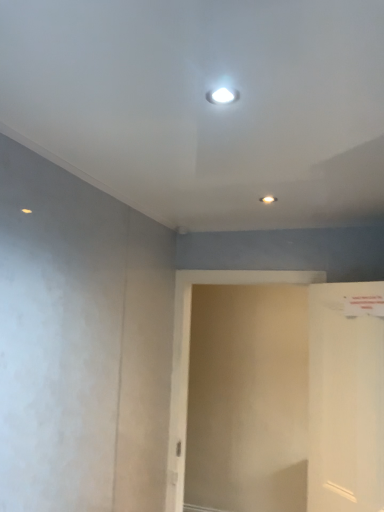
Question: Is white glossy door at right taller or shorter than beige matte screen door at center?

Choices:
 (A) short
 (B) tall

Answer: (A)

Question: From a real-world perspective, is white glossy door at right positioned above or below beige matte screen door at center?

Choices:
 (A) above
 (B) below

Answer: (A)

Question: Considering their positions, is white glossy door at right located in front of or behind beige matte screen door at center?

Choices:
 (A) behind
 (B) front

Answer: (B)

Question: From the image's perspective, relative to white glossy door at right, is beige matte screen door at center above or below?

Choices:
 (A) above
 (B) below

Answer: (B)

Question: Considering the positions of beige matte screen door at center and white glossy door at right in the image, is beige matte screen door at center bigger or smaller than white glossy door at right?

Choices:
 (A) big
 (B) small

Answer: (A)

Question: From a real-world perspective, is beige matte screen door at center physically located above or below white glossy door at right?

Choices:
 (A) below
 (B) above

Answer: (A)

Question: In terms of width, does beige matte screen door at center look wider or thinner when compared to white glossy door at right?

Choices:
 (A) thin
 (B) wide

Answer: (A)